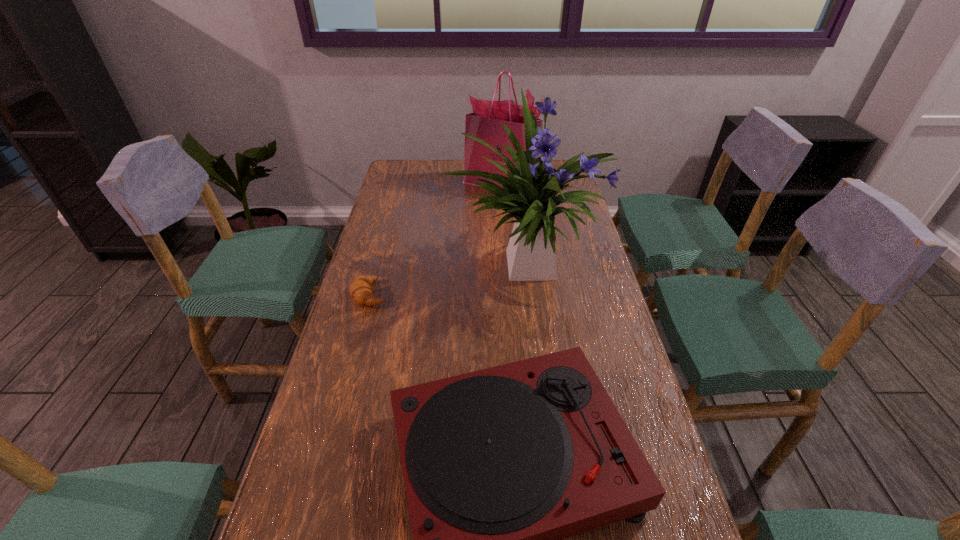
Locate an element on the screen. free space between the flower arrangement and the shortest object is located at coordinates (447, 279).

Locate which object is the closest to the flower arrangement. Please provide its 2D coordinates. Your answer should be formatted as a tuple, i.e. [(x, y)], where the tuple contains the x and y coordinates of a point satisfying the conditions above.

[(485, 123)]

I want to click on object that is the third nearest to the nearest object, so click(485, 123).

Find the location of a particular element. The width and height of the screenshot is (960, 540). vacant point that satisfies the following two spatial constraints: 1. on the front side of the flower arrangement; 2. on the left side of the shopping bag is located at coordinates (508, 264).